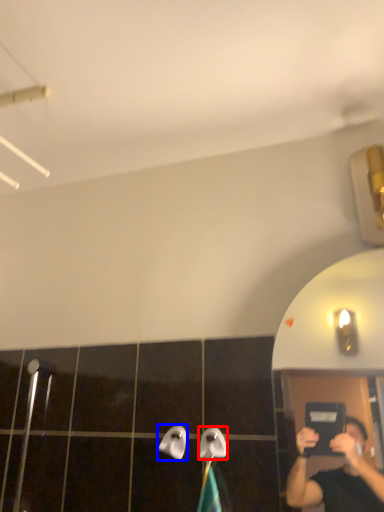
Question: Which object is closer to the camera taking this photo, towel bar (highlighted by a red box) or towel bar (highlighted by a blue box)?

Choices:
 (A) towel bar
 (B) towel bar

Answer: (A)